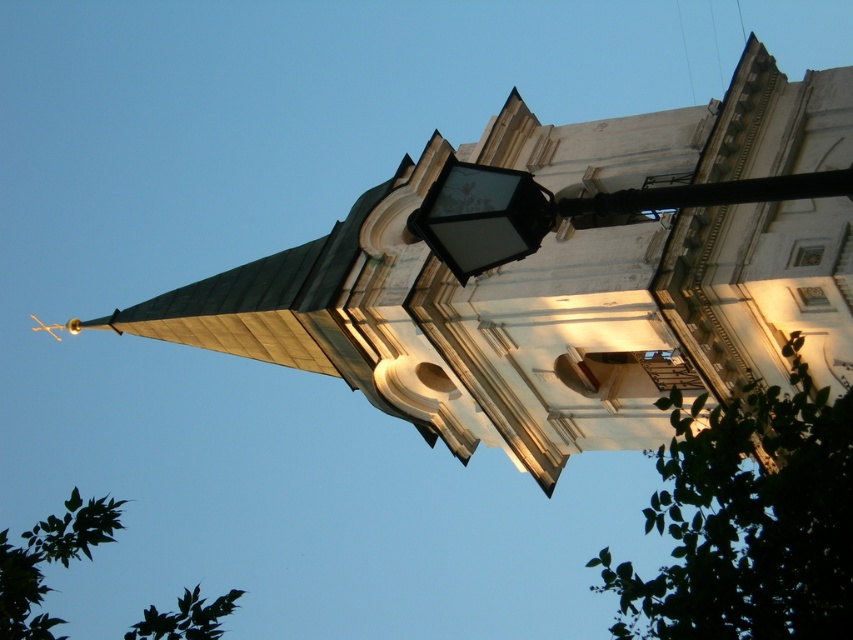
Who is positioned more to the right, green leafy tree at lower right or green leafy tree at lower left?

green leafy tree at lower right

Is green leafy tree at lower right wider than green leafy tree at lower left?

No.

Find the location of a particular element. Image resolution: width=853 pixels, height=640 pixels. green leafy tree at lower right is located at coordinates (747, 518).

Can you confirm if black glass lamp post at upper center is thinner than green leafy tree at lower left?

Indeed, black glass lamp post at upper center has a lesser width compared to green leafy tree at lower left.

Consider the image. Does black glass lamp post at upper center have a smaller size compared to green leafy tree at lower left?

Indeed, black glass lamp post at upper center has a smaller size compared to green leafy tree at lower left.

Describe the element at coordinates (566, 209) in the screenshot. The width and height of the screenshot is (853, 640). I see `black glass lamp post at upper center` at that location.

The height and width of the screenshot is (640, 853). I want to click on black glass lamp post at upper center, so click(x=566, y=209).

Does green stone church steeple at upper center have a greater height compared to green leafy tree at lower left?

No, green stone church steeple at upper center is not taller than green leafy tree at lower left.

Consider the image. Is green stone church steeple at upper center closer to camera compared to green leafy tree at lower left?

Yes, green stone church steeple at upper center is closer to the viewer.

Image resolution: width=853 pixels, height=640 pixels. What do you see at coordinates (564, 280) in the screenshot?
I see `green stone church steeple at upper center` at bounding box center [564, 280].

Identify the location of green stone church steeple at upper center. (564, 280).